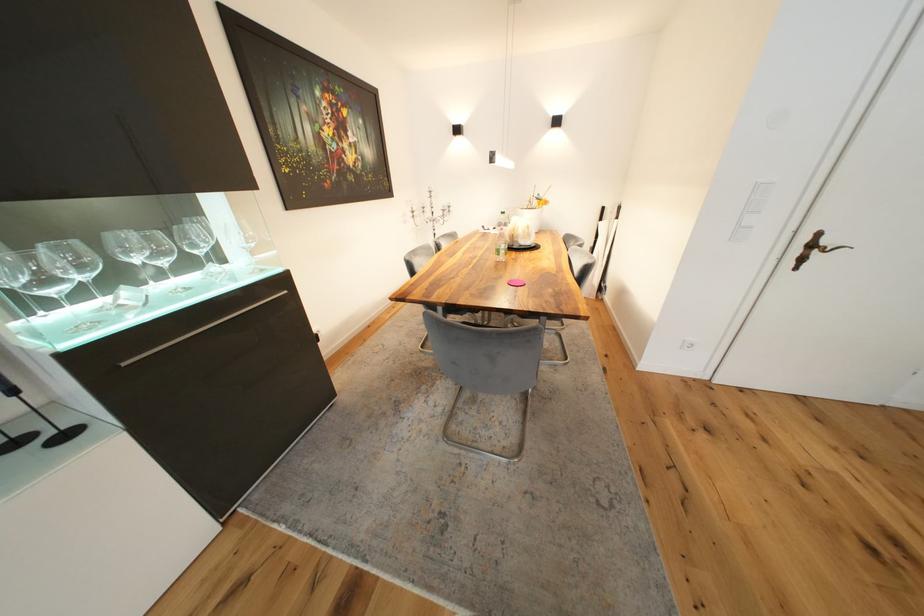
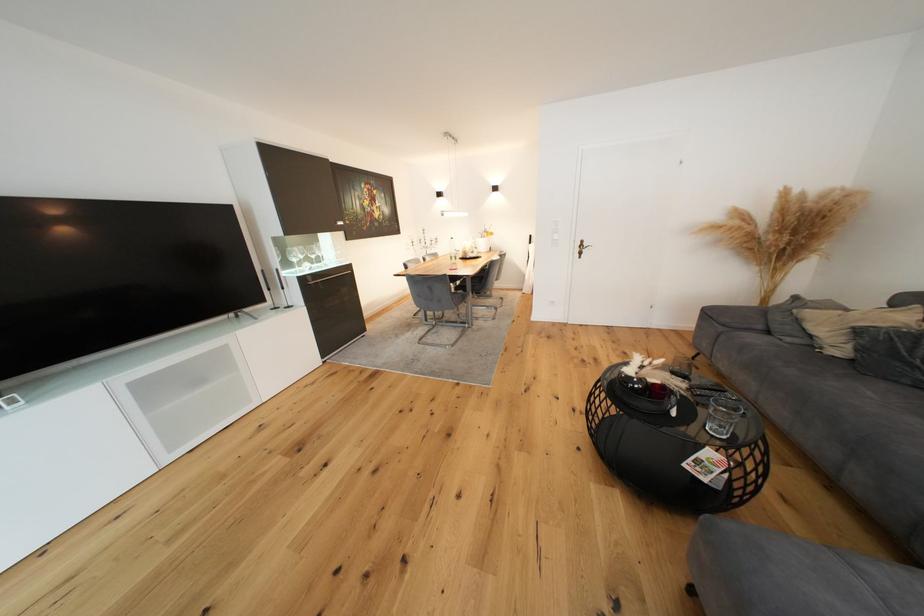
In the second image, find the point that corresponds to point (444, 215) in the first image.

(435, 245)